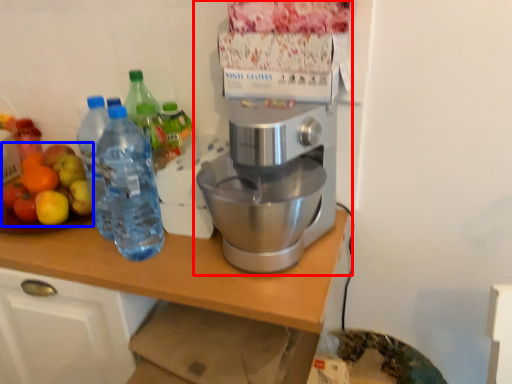
Question: Which object is closer to the camera taking this photo, coffee maker (highlighted by a red box) or fruit salad (highlighted by a blue box)?

Choices:
 (A) coffee maker
 (B) fruit salad

Answer: (A)